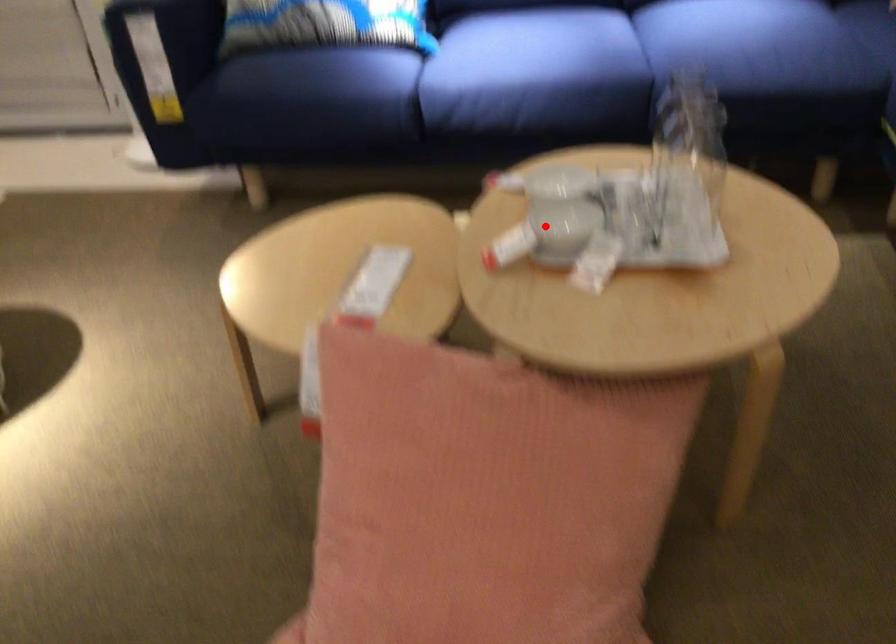
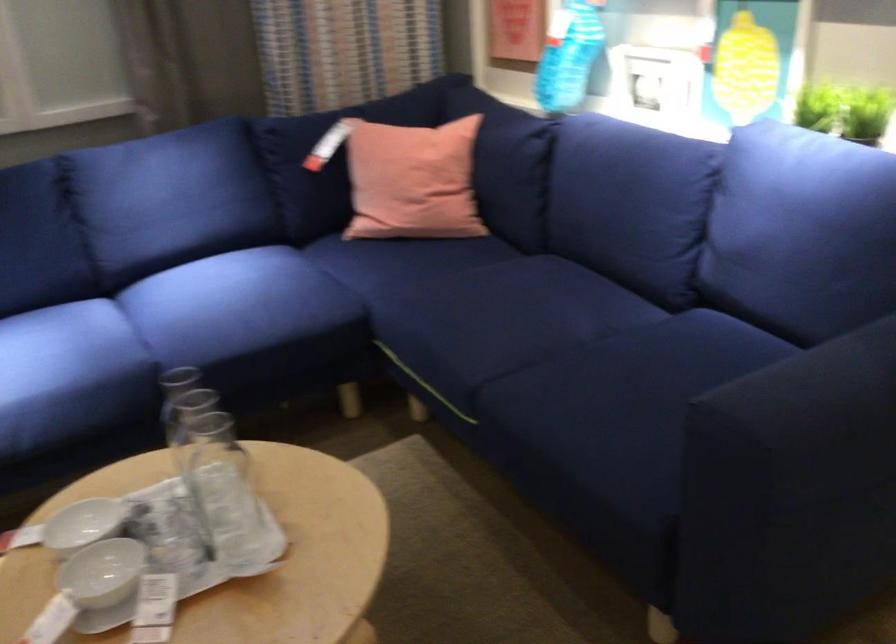
The point at the highlighted location is marked in the first image. Where is the corresponding point in the second image?

(102, 572)